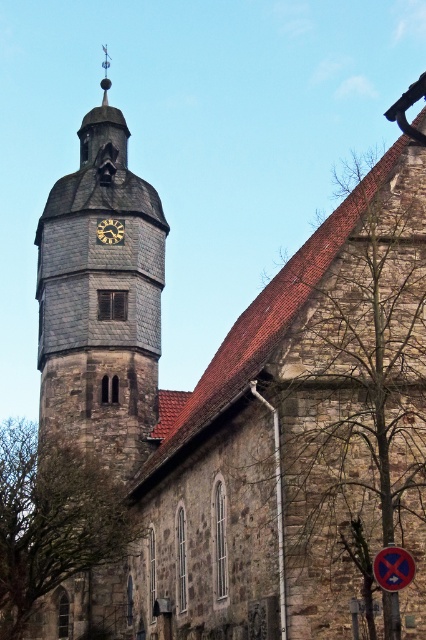
You are a tourist standing in front of the historic stone church. You notice the stone clock tower at center and the metallic reflective sign at center. Which object would appear bigger to you?

The stone clock tower at center is larger in size than the metallic reflective sign at center, so it would appear bigger to you.

You are standing in front of the historic stone church and want to read the text on the metallic reflective sign at center. Based on the distance, can you read the text clearly without moving closer?

The metallic reflective sign at center is 34.19 meters from viewer, so it is too far away to read the text clearly without moving closer.

You are standing in front of the historic stone church and want to reach both the metallic reflective sign at center and the matte gray clock at center. Which object is farther away from you?

The metallic reflective sign at center is 50.15 meters away from the matte gray clock at center, so the metallic reflective sign at center is farther away from you than the matte gray clock at center.